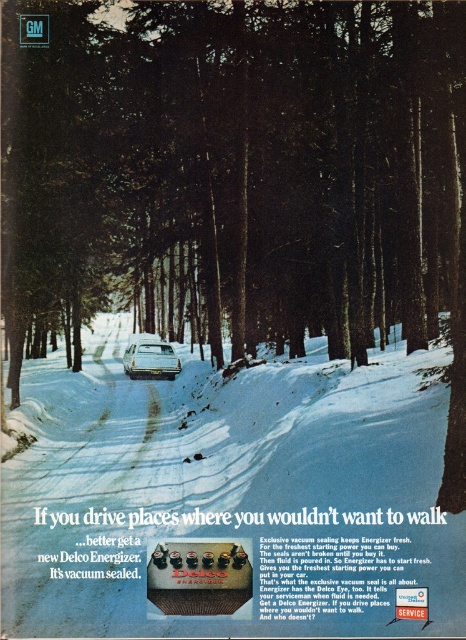
You are a photographer trying to capture the Delco Energizer advertisement scene. You notice the white powdery snow at center and the shiny silver car at center. Which object is located above the other?

The white powdery snow at center is positioned over the shiny silver car at center, meaning it is above the car.

In the scene shown: In the vintage Delco Energizer advertisement scene, there is white powdery snow at center and a shiny silver car at center. Which object occupies a larger area in the image?

The white powdery snow at center is bigger than the shiny silver car at center, so the snow occupies a larger area in the image.